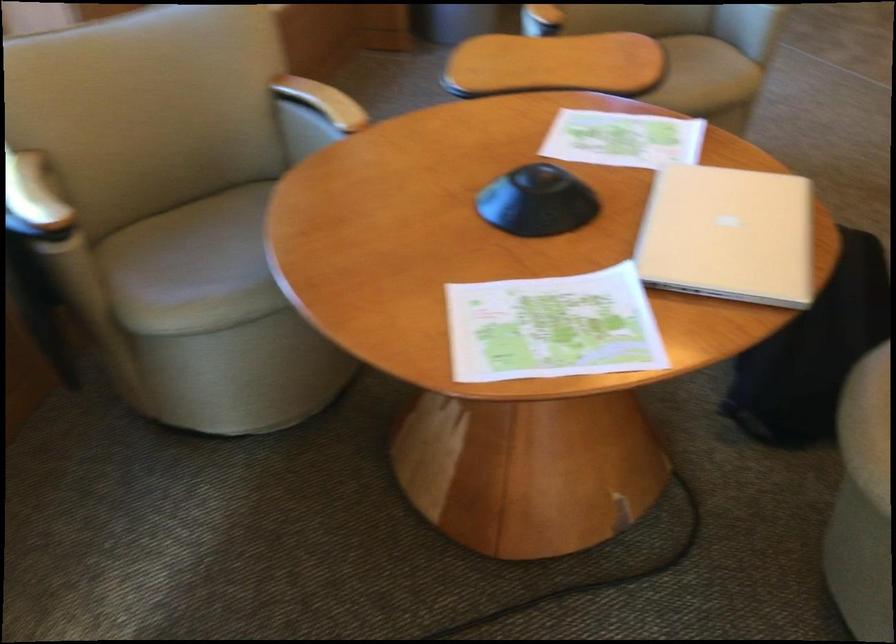
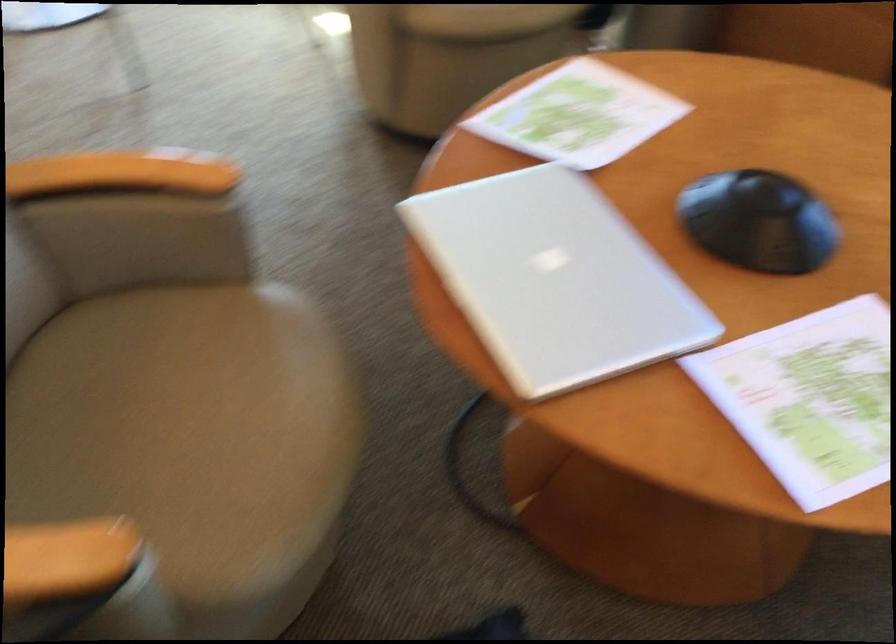
Find the pixel in the second image that matches (652,230) in the first image.

(555, 279)